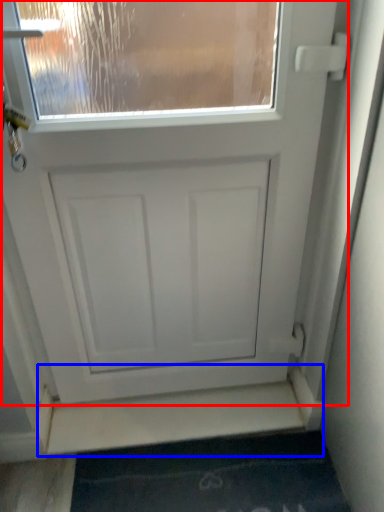
Question: Which object appears farthest to the camera in this image, door (highlighted by a red box) or stairwell (highlighted by a blue box)?

Choices:
 (A) door
 (B) stairwell

Answer: (B)